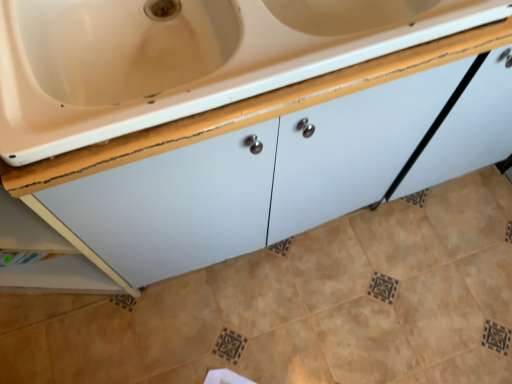
What do you see at coordinates (210, 134) in the screenshot? This screenshot has width=512, height=384. I see `white glossy cabinet at center` at bounding box center [210, 134].

What is the approximate width of white glossy cabinet at center?

white glossy cabinet at center is 20.75 inches wide.

Find the location of `white glossy cabinet at center`. white glossy cabinet at center is located at coordinates (210, 134).

What do you see at coordinates (300, 306) in the screenshot?
I see `beige ceramic tile at center` at bounding box center [300, 306].

Where is `beige ceramic tile at center`? beige ceramic tile at center is located at coordinates (300, 306).

Measure the distance between point (69, 301) and camera.

A distance of 4.30 feet exists between point (69, 301) and camera.

Where is `white glossy cabinet at center`? Image resolution: width=512 pixels, height=384 pixels. white glossy cabinet at center is located at coordinates (210, 134).

Which is more to the right, beige ceramic tile at center or white glossy cabinet at center?

From the viewer's perspective, beige ceramic tile at center appears more on the right side.

Between beige ceramic tile at center and white glossy cabinet at center, which one is positioned in front?

white glossy cabinet at center is more forward.

Does point (131, 345) come behind point (200, 114)?

That is True.

From the image's perspective, which one is positioned higher, beige ceramic tile at center or white glossy cabinet at center?

From the image's view, white glossy cabinet at center is above.

From a real-world perspective, which is physically above, beige ceramic tile at center or white glossy cabinet at center?

white glossy cabinet at center is physically above.

Can you confirm if beige ceramic tile at center is wider than white glossy cabinet at center?

Yes, beige ceramic tile at center is wider than white glossy cabinet at center.

Which of these two, beige ceramic tile at center or white glossy cabinet at center, stands taller?

With more height is white glossy cabinet at center.

In the scene shown: Is beige ceramic tile at center bigger than white glossy cabinet at center?

Indeed, beige ceramic tile at center has a larger size compared to white glossy cabinet at center.

Is beige ceramic tile at center spatially inside white glossy cabinet at center, or outside of it?

beige ceramic tile at center is spatially situated outside white glossy cabinet at center.

Does beige ceramic tile at center touch white glossy cabinet at center?

beige ceramic tile at center is not next to white glossy cabinet at center, and they're not touching.

Is beige ceramic tile at center looking in the opposite direction of white glossy cabinet at center?

No.

What's the angular difference between beige ceramic tile at center and white glossy cabinet at center's facing directions?

beige ceramic tile at center and white glossy cabinet at center are facing 88.8 degrees away from each other.

Where is `cabinetry in front of the beige ceramic tile at center`? cabinetry in front of the beige ceramic tile at center is located at coordinates (210, 134).

Can you confirm if white glossy cabinet at center is positioned to the right of beige ceramic tile at center?

Incorrect, white glossy cabinet at center is not on the right side of beige ceramic tile at center.

Considering their positions, is white glossy cabinet at center located in front of or behind beige ceramic tile at center?

In the image, white glossy cabinet at center appears in front of beige ceramic tile at center.

Is point (182, 125) positioned after point (373, 222)?

That is False.

From the image's perspective, is white glossy cabinet at center located above or below beige ceramic tile at center?

white glossy cabinet at center is above beige ceramic tile at center.

Consider the image. From a real-world perspective, which is physically above, white glossy cabinet at center or beige ceramic tile at center?

white glossy cabinet at center.

Does white glossy cabinet at center have a greater width compared to beige ceramic tile at center?

In fact, white glossy cabinet at center might be narrower than beige ceramic tile at center.

Can you confirm if white glossy cabinet at center is shorter than beige ceramic tile at center?

No, white glossy cabinet at center is not shorter than beige ceramic tile at center.

Considering the sizes of objects white glossy cabinet at center and beige ceramic tile at center in the image provided, who is bigger, white glossy cabinet at center or beige ceramic tile at center?

beige ceramic tile at center is bigger.

Is white glossy cabinet at center inside the boundaries of beige ceramic tile at center, or outside?

white glossy cabinet at center is not inside beige ceramic tile at center, it's outside.

Is white glossy cabinet at center positioned far away from beige ceramic tile at center?

Actually, white glossy cabinet at center and beige ceramic tile at center are a little close together.

Is white glossy cabinet at center oriented away from beige ceramic tile at center?

No.

How distant is white glossy cabinet at center from beige ceramic tile at center?

28.32 inches.

What are the coordinates of `cabinetry on the left of the beige ceramic tile at center` in the screenshot? It's located at (210, 134).

There is a beige ceramic tile at center. At what (x,y) coordinates should I click in order to perform the action: click on cabinetry above it (from a real-world perspective). Please return your answer as a coordinate pair (x, y). Looking at the image, I should click on (210, 134).

Find the location of a particular element. ceramic tile located behind the white glossy cabinet at center is located at coordinates (300, 306).